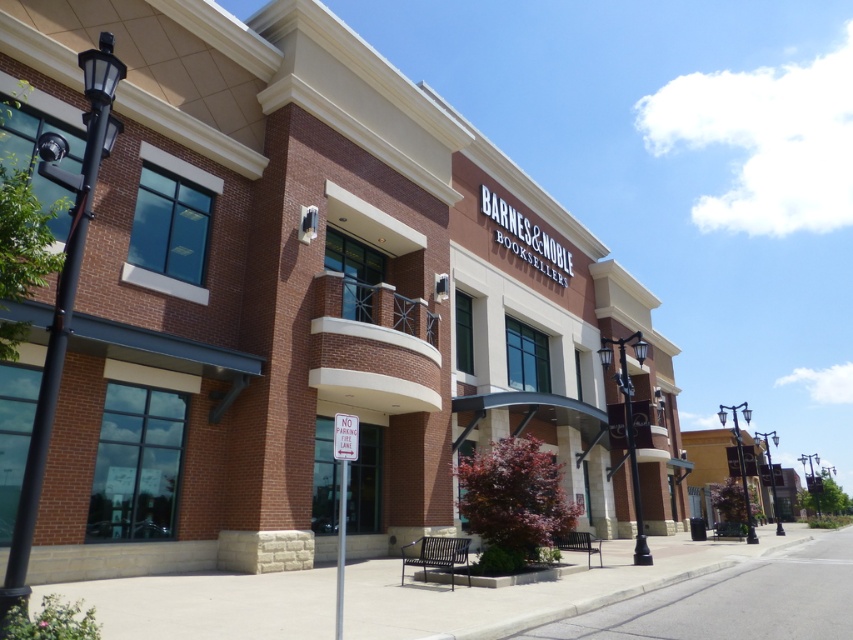
You are standing in front of the Barnes and Noble store and want to take a photo of the two points on the building. Which point, point (782, 531) or point (817, 481), will appear larger in your camera view?

Point (782, 531) will appear larger in the camera view because it is closer to the camera than point (817, 481).

You are standing in front of the Barnes and Noble store and want to walk to the entrance. Which object should you step onto first, the gray concrete pavement at lower center or the gray concrete sidewalk at lower center?

The gray concrete pavement at lower center is below the gray concrete sidewalk at lower center, so you should step onto the gray concrete sidewalk at lower center first before reaching the gray concrete pavement at lower center.